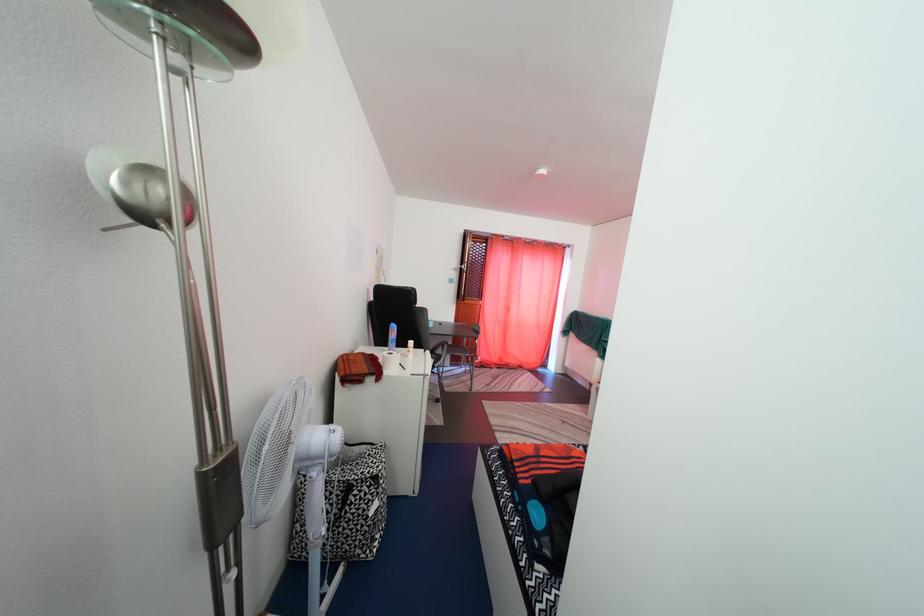
Locate an element on the screen. The image size is (924, 616). long door handle is located at coordinates (468, 265).